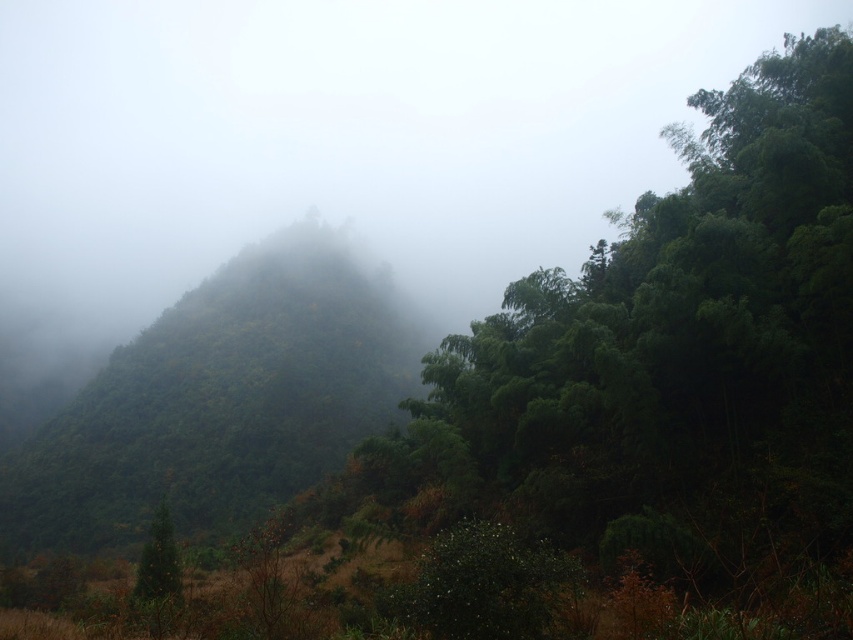
Between green matte forest at center and green matte tree at lower left, which one is positioned lower?

green matte tree at lower left is lower down.

What do you see at coordinates (222, 401) in the screenshot? I see `green matte forest at center` at bounding box center [222, 401].

Between point (138, 522) and point (169, 577), which one is positioned behind?

The point (138, 522) is behind.

At what (x,y) coordinates should I click in order to perform the action: click on green matte forest at center. Please return your answer as a coordinate pair (x, y). Image resolution: width=853 pixels, height=640 pixels. Looking at the image, I should click on (222, 401).